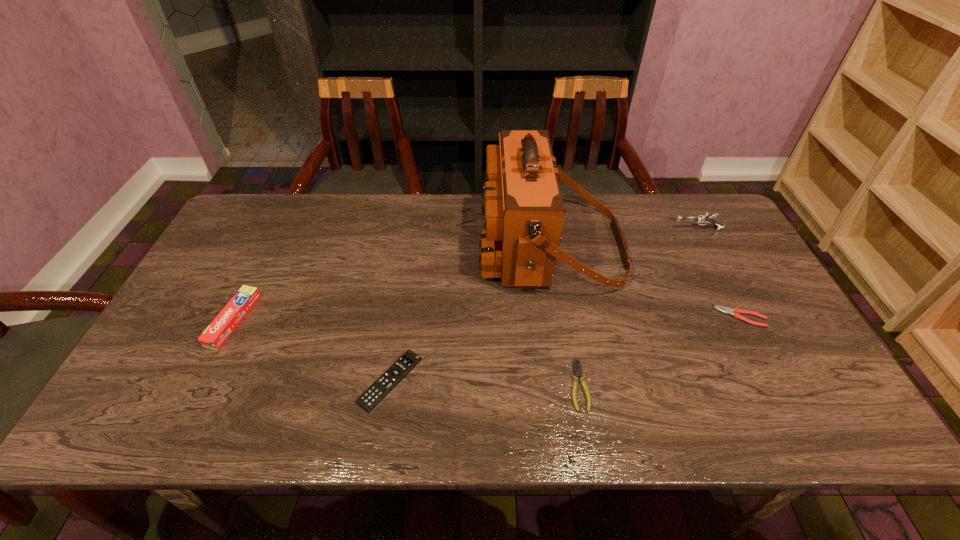
This screenshot has width=960, height=540. I want to click on pliers at the near edge, so click(577, 372).

I want to click on object present at the left edge, so click(x=215, y=335).

The width and height of the screenshot is (960, 540). In order to click on gun present at the right edge in this screenshot , I will do [704, 219].

This screenshot has width=960, height=540. In order to click on pliers positioned at the right edge in this screenshot , I will do `click(736, 312)`.

Find the location of a particular element. The height and width of the screenshot is (540, 960). object located at the far right corner is located at coordinates (704, 219).

You are a GUI agent. You are given a task and a screenshot of the screen. Output one action in this format:
    pyautogui.click(x=<x>, y=<y>)
    Task: Click on the free region at the far edge of the desktop
    Image resolution: width=960 pixels, height=540 pixels.
    Given the screenshot: What is the action you would take?
    pyautogui.click(x=422, y=223)

Identify the location of vacant space at the near edge of the desktop. (290, 429).

Where is `free space at the left edge of the desktop`? This screenshot has height=540, width=960. free space at the left edge of the desktop is located at coordinates (192, 287).

In the image, there is a desktop. Identify the location of blank space at the right edge. The height and width of the screenshot is (540, 960). (762, 397).

Locate an element on the screen. The width and height of the screenshot is (960, 540). vacant space at the far left corner of the desktop is located at coordinates (251, 207).